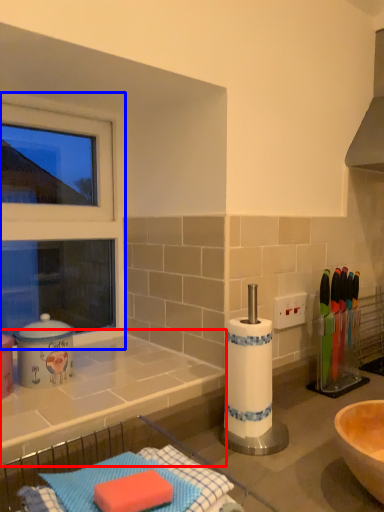
Question: Which point is further to the camera, countertop (highlighted by a red box) or window frame (highlighted by a blue box)?

Choices:
 (A) countertop
 (B) window frame

Answer: (B)